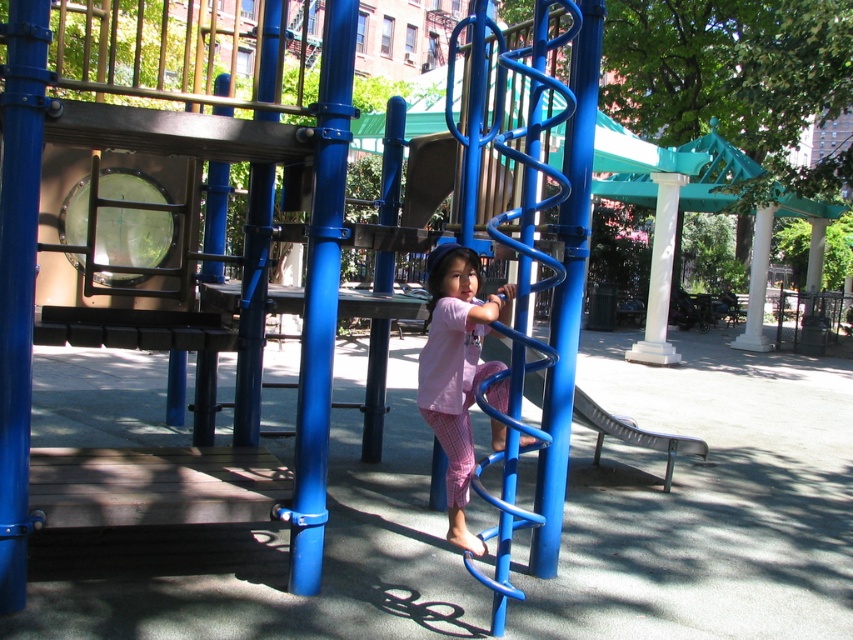
Is pink cotton pants at center bigger than metallic blue slide at center?

No, pink cotton pants at center is not bigger than metallic blue slide at center.

Does point (451, 502) lie in front of point (538, 378)?

Yes, point (451, 502) is closer to viewer.

Where is `pink cotton pants at center`? Image resolution: width=853 pixels, height=640 pixels. pink cotton pants at center is located at coordinates (456, 369).